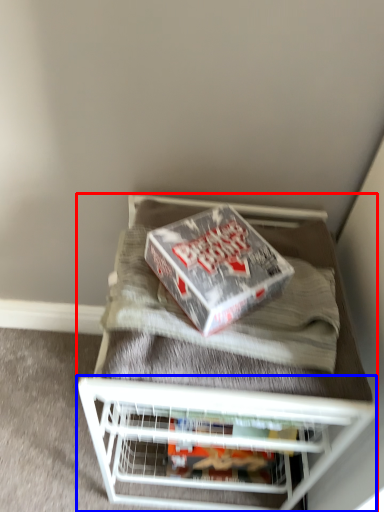
Question: Which object appears farthest to the camera in this image, furniture (highlighted by a red box) or shelf (highlighted by a blue box)?

Choices:
 (A) furniture
 (B) shelf

Answer: (B)